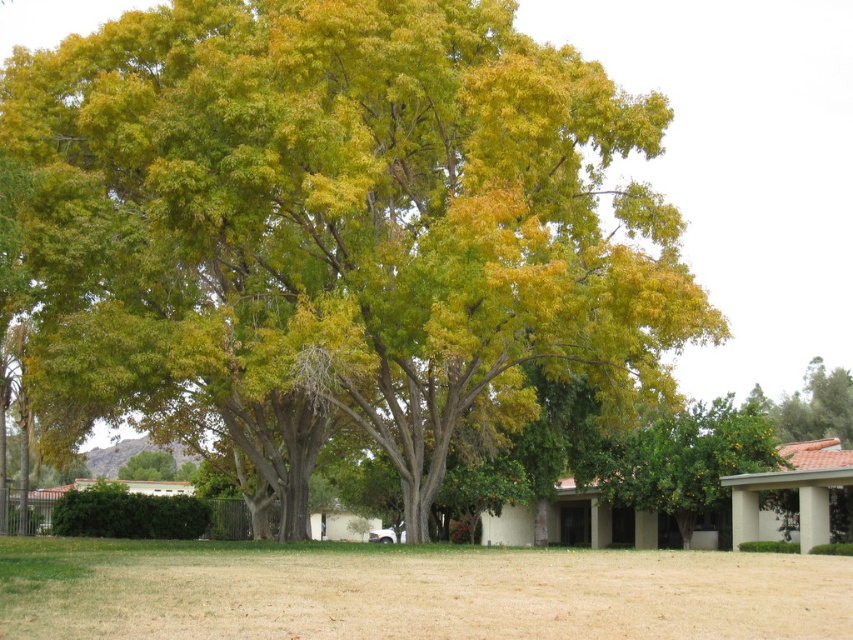
Question: Does green leafy tree at center appear on the right side of brown dry grass at lower center?

Choices:
 (A) no
 (B) yes

Answer: (A)

Question: Does green leafy tree at center lie in front of brown dry grass at lower center?

Choices:
 (A) yes
 (B) no

Answer: (B)

Question: Which point is closer to the camera taking this photo?

Choices:
 (A) (288, 554)
 (B) (102, 285)

Answer: (A)

Question: In this image, where is green leafy tree at center located relative to brown dry grass at lower center?

Choices:
 (A) right
 (B) left

Answer: (B)

Question: Which of the following is the closest to the observer?

Choices:
 (A) (212, 378)
 (B) (544, 621)

Answer: (B)